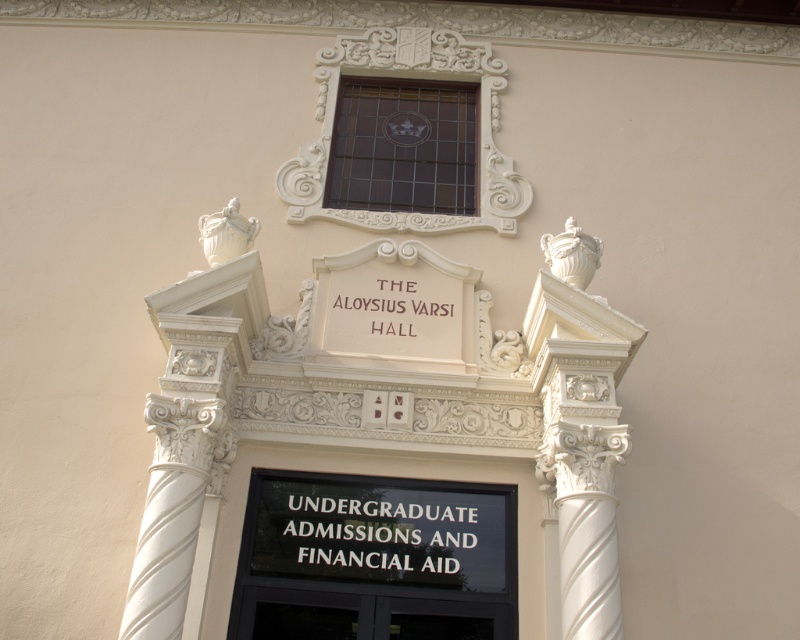
Question: Which point appears closest to the camera in this image?

Choices:
 (A) (570, 426)
 (B) (350, 275)
 (C) (236, 596)

Answer: (A)

Question: Where is white marble column at right located in relation to white wood sign at center in the image?

Choices:
 (A) above
 (B) below

Answer: (B)

Question: Considering the relative positions of white marble column at right and white wood sign at center in the image provided, where is white marble column at right located with respect to white wood sign at center?

Choices:
 (A) right
 (B) left

Answer: (A)

Question: Can you confirm if black glass sign at center is wider than white marble column at right?

Choices:
 (A) yes
 (B) no

Answer: (A)

Question: Among these points, which one is farthest from the camera?

Choices:
 (A) (454, 346)
 (B) (408, 572)

Answer: (A)

Question: Which point is farther to the camera?

Choices:
 (A) (450, 557)
 (B) (462, 296)
 (C) (584, 440)

Answer: (B)